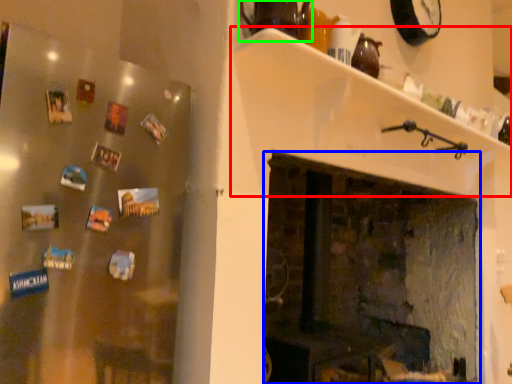
Question: Which object is positioned farthest from shelf (highlighted by a red box)? Select from fireplace (highlighted by a blue box) and tea pot (highlighted by a green box).

Choices:
 (A) fireplace
 (B) tea pot

Answer: (A)